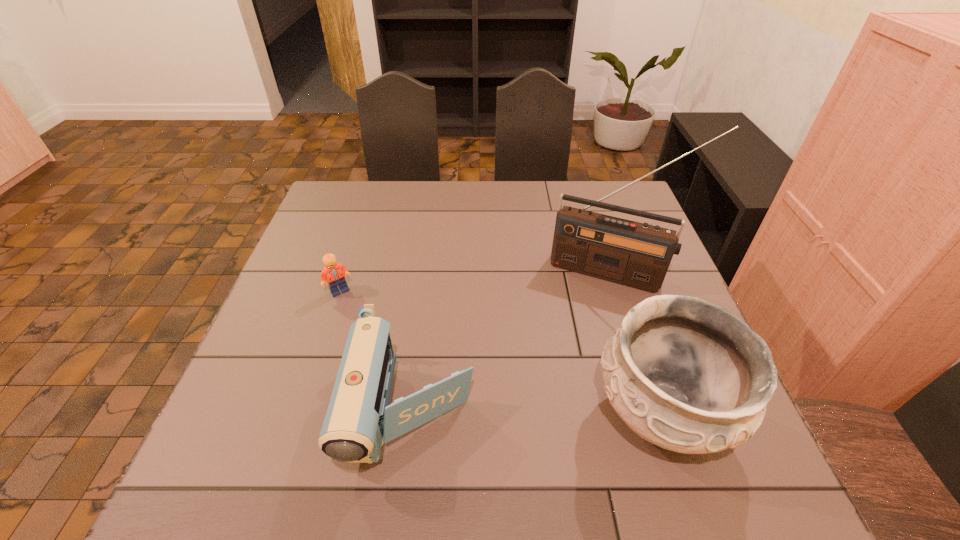
Where is `the second closest object relative to the Lego`? Image resolution: width=960 pixels, height=540 pixels. the second closest object relative to the Lego is located at coordinates (637, 255).

You are a GUI agent. You are given a task and a screenshot of the screen. Output one action in this format:
    pyautogui.click(x=<x>, y=<y>)
    Task: Click on the vacant point that satisfies the following two spatial constraints: 1. on the front side of the second tallest object; 2. on the left side of the Lego
    The width and height of the screenshot is (960, 540).
    Given the screenshot: What is the action you would take?
    pyautogui.click(x=300, y=412)